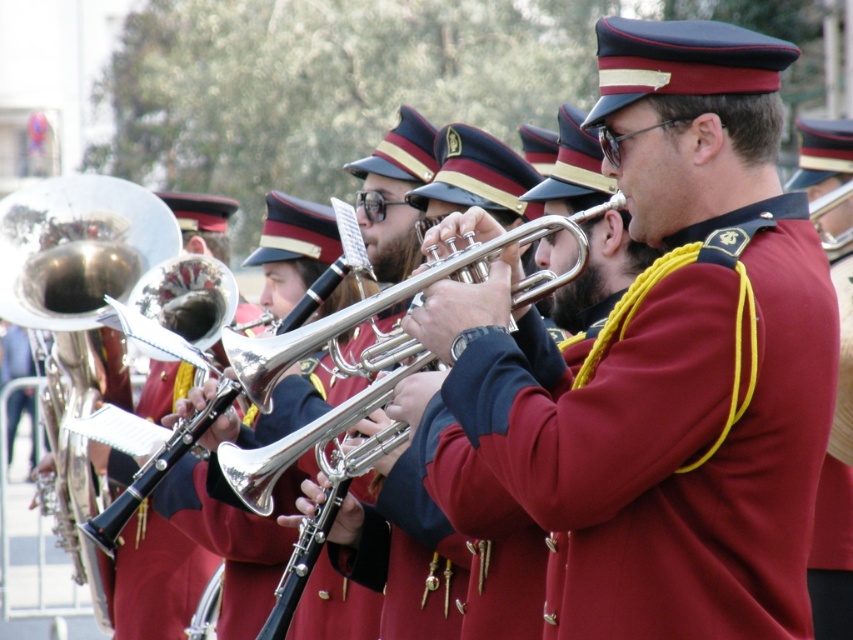
You are a photographer trying to capture a photo of the silver shiny trumpet at center without the maroon fabric uniform at center blocking it. Based on their positions, is it possible to frame the shot so the trumpet is visible without the uniform blocking it?

The maroon fabric uniform at center is positioned on the right side of the silver shiny trumpet at center. Since the uniform is to the right of the trumpet, you can frame the shot by focusing on the left side of the trumpet to avoid the uniform blocking it.

You are a photographer positioned at the front of the musicians. You want to capture a closeup shot of both the shiny brass trumpet at center and the silver shiny trumpet at center in a single frame. Given that your camera has a depth of field that can focus clearly on objects within a 5 feet range, will both trumpets be in focus?

The shiny brass trumpet at center is 8.89 feet away from the silver shiny trumpet at center. Since the distance between them exceeds the 5 feet depth of field range, only one of the trumpets will be in focus at a time.

Based on the photo, you are a photographer trying to capture a clear shot of the maroon fabric uniform at center and the silver shiny trumpet at center. Which object is closer to the camera?

The silver shiny trumpet at center is closer to the camera because the maroon fabric uniform at center is positioned under it.